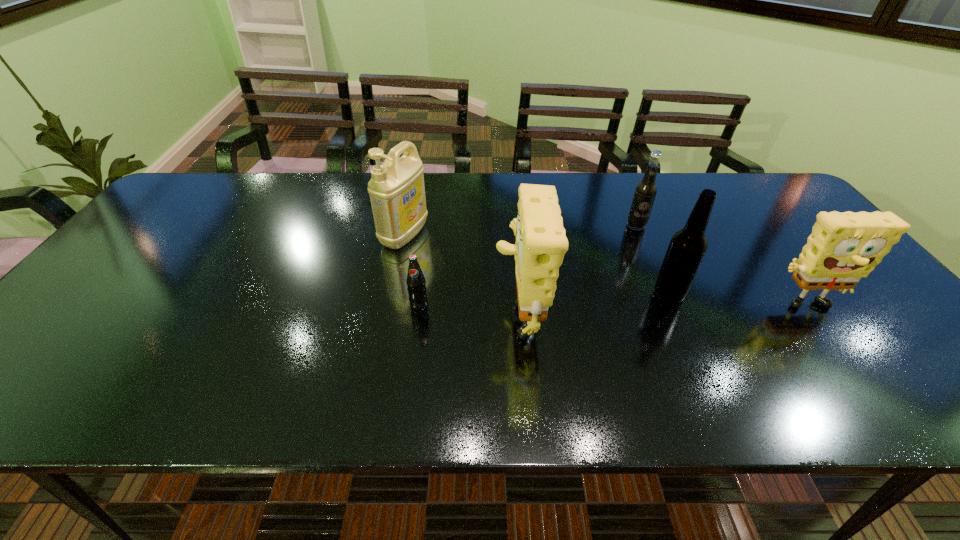
The image size is (960, 540). In order to click on the left sponge in this screenshot , I will do `click(541, 242)`.

Where is `the third object from left to right`? the third object from left to right is located at coordinates (541, 242).

In order to click on the right sponge in this screenshot , I will do `click(843, 247)`.

Locate an element on the screen. This screenshot has height=540, width=960. the shorter sponge is located at coordinates (843, 247).

At what (x,y) coordinates should I click in order to perform the action: click on root beer. Please return your answer as a coordinate pair (x, y). Looking at the image, I should click on (645, 192).

This screenshot has width=960, height=540. What are the coordinates of `detergent` in the screenshot? It's located at (397, 192).

Find the location of a particular element. This screenshot has width=960, height=540. pop is located at coordinates (416, 284).

Locate an element on the screen. The image size is (960, 540). beer bottle is located at coordinates (686, 250).

Find the location of a particular element. The height and width of the screenshot is (540, 960). vacant space located on the face of the taller sponge is located at coordinates (472, 312).

The height and width of the screenshot is (540, 960). I want to click on free location located 0.130m on the face of the taller sponge, so click(439, 312).